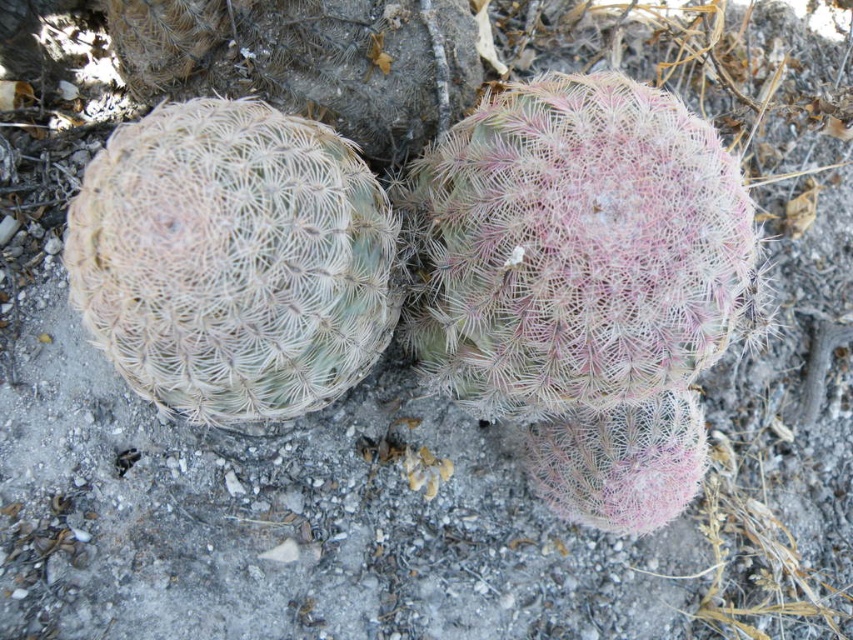
Question: Does pink spiky cactus at center have a larger size compared to white spiky cactus at left?

Choices:
 (A) yes
 (B) no

Answer: (A)

Question: Which point appears closest to the camera in this image?

Choices:
 (A) (631, 202)
 (B) (270, 388)

Answer: (B)

Question: Which of the following is the farthest from the observer?

Choices:
 (A) pink spiky cactus at center
 (B) white spiky cactus at left

Answer: (A)

Question: Which of the following is the closest to the observer?

Choices:
 (A) (320, 324)
 (B) (454, 381)

Answer: (A)

Question: Does pink spiky cactus at center have a larger size compared to white spiky cactus at left?

Choices:
 (A) yes
 (B) no

Answer: (A)

Question: Does pink spiky cactus at center have a greater width compared to white spiky cactus at left?

Choices:
 (A) yes
 (B) no

Answer: (A)